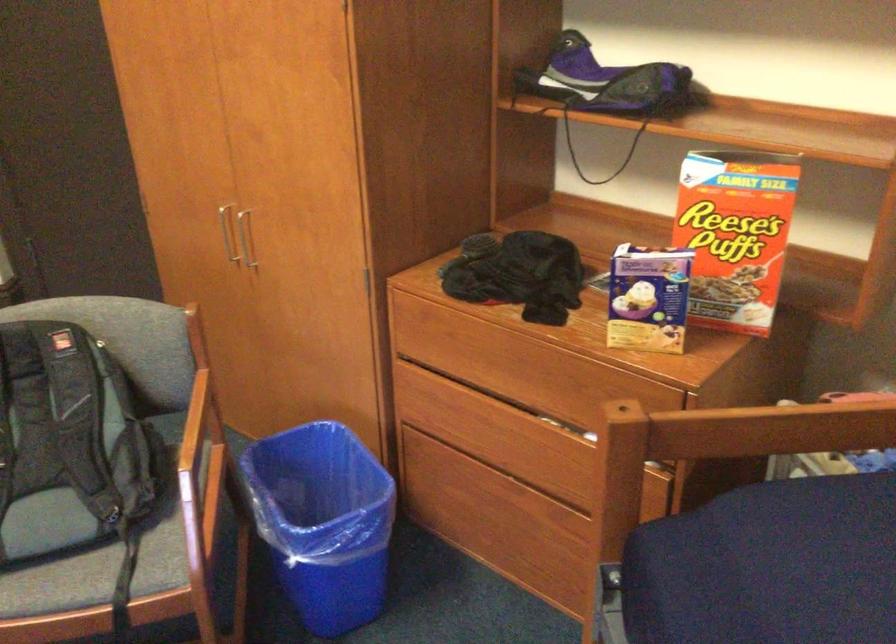
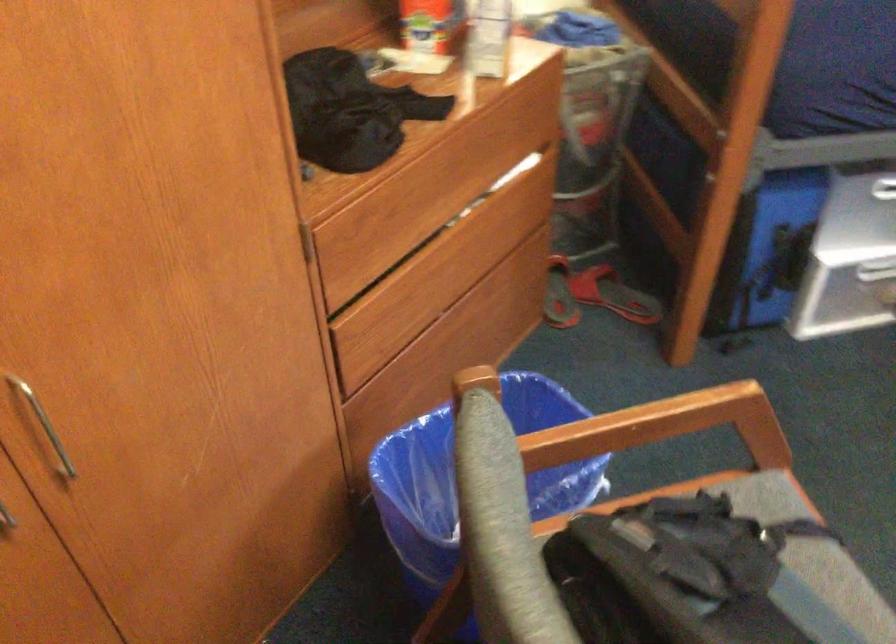
The point at (488,355) is marked in the first image. Where is the corresponding point in the second image?

(421, 187)